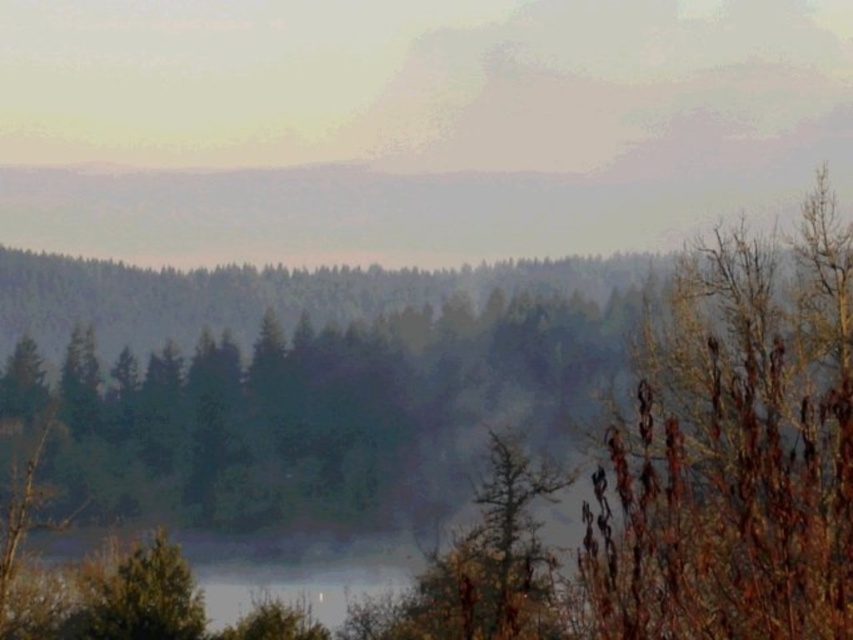
You are standing in the landscape scene and want to walk from the point closer to you to the point further away. Which path would you take between the two points, point (675, 440) and point (148, 621)?

You should walk towards point (148, 621) because it is further away from you compared to point (675, 440), which is closer.

You are an outdoor photographer planning to capture the landscape. You notice the foggy mist at upper center and the green matte tree at lower left. Which object takes up more space in the image?

The foggy mist at upper center takes up more space in the image because it is bigger than the green matte tree at lower left.